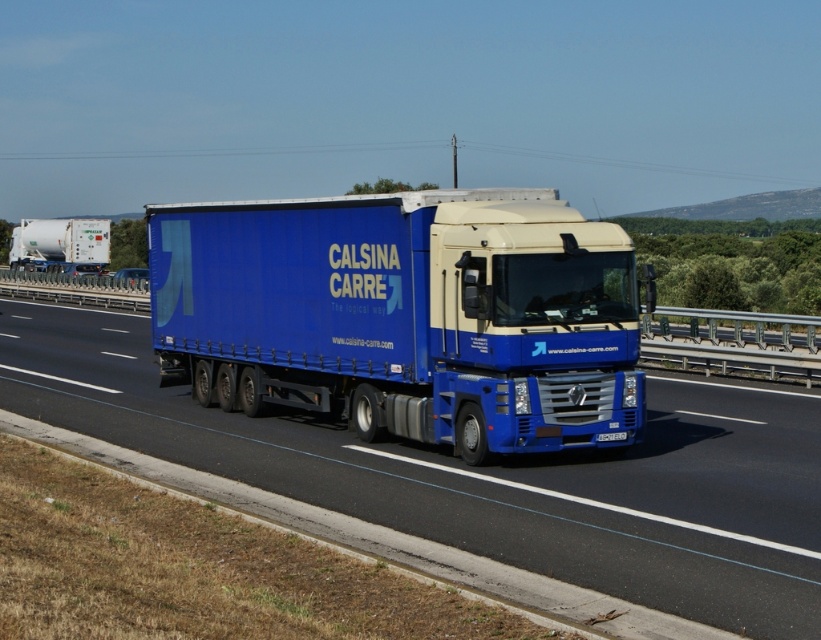
Can you confirm if blue metallic truck at center is bigger than white matte tank at left?

No, blue metallic truck at center is not bigger than white matte tank at left.

Is point (815, 532) positioned in front of point (92, 234)?

Yes.

The height and width of the screenshot is (640, 821). What do you see at coordinates (489, 476) in the screenshot?
I see `blue metallic truck at center` at bounding box center [489, 476].

The image size is (821, 640). Find the location of `blue metallic truck at center`. blue metallic truck at center is located at coordinates (489, 476).

Does blue matte trailer truck at center have a greater width compared to blue metallic truck at center?

In fact, blue matte trailer truck at center might be narrower than blue metallic truck at center.

Does blue matte trailer truck at center appear under blue metallic truck at center?

No, blue matte trailer truck at center is not below blue metallic truck at center.

Locate an element on the screen. blue matte trailer truck at center is located at coordinates (406, 314).

Image resolution: width=821 pixels, height=640 pixels. What are the coordinates of `blue matte trailer truck at center` in the screenshot? It's located at (406, 314).

Can you confirm if blue matte trailer truck at center is positioned to the left of white plastic license plate at center?

Yes, blue matte trailer truck at center is to the left of white plastic license plate at center.

Does blue matte trailer truck at center have a lesser height compared to white plastic license plate at center?

In fact, blue matte trailer truck at center may be taller than white plastic license plate at center.

Which is in front, point (277, 304) or point (626, 435)?

Point (626, 435) is in front.

Where is `blue matte trailer truck at center`? The image size is (821, 640). blue matte trailer truck at center is located at coordinates 406,314.